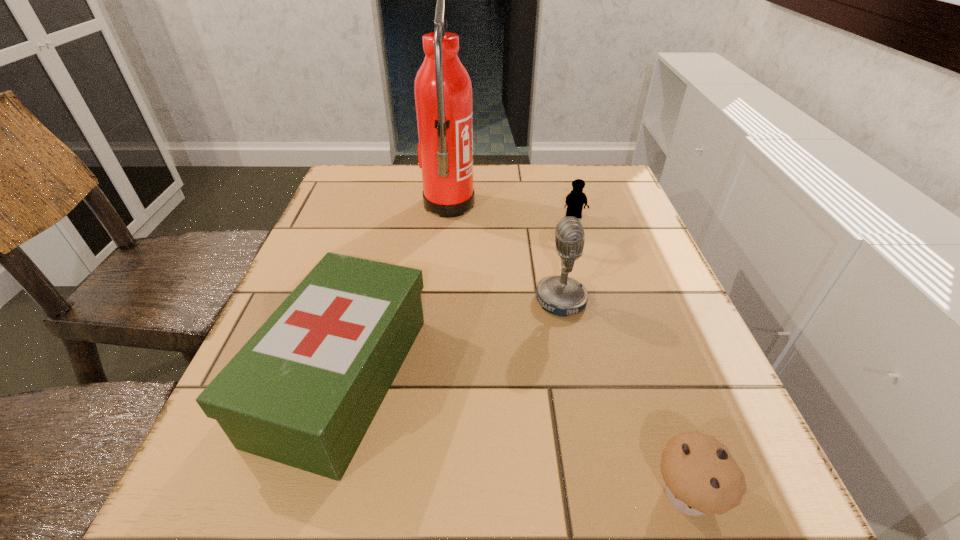
In the image, there is a desktop. Identify the location of vacant space at the far edge. This screenshot has width=960, height=540. (526, 165).

In the image, there is a desktop. Find the location of `free region at the near edge`. free region at the near edge is located at coordinates (552, 522).

Where is `vacant space at the left edge`? The width and height of the screenshot is (960, 540). vacant space at the left edge is located at coordinates (367, 241).

At what (x,y) coordinates should I click in order to perform the action: click on vacant space at the right edge. Please return your answer as a coordinate pair (x, y). Looking at the image, I should click on (637, 448).

Where is `vacant space at the far left corner of the desktop`? The width and height of the screenshot is (960, 540). vacant space at the far left corner of the desktop is located at coordinates (376, 171).

The image size is (960, 540). Identify the location of free space at the far right corner. (596, 168).

This screenshot has height=540, width=960. Identify the location of free space between the muffin and the Lego. (630, 355).

You are a GUI agent. You are given a task and a screenshot of the screen. Output one action in this format:
    pyautogui.click(x=<x>, y=<y>)
    Task: Click on the empty location between the Lego and the first-aid kit
    The image size is (960, 540).
    Given the screenshot: What is the action you would take?
    [458, 298]

The width and height of the screenshot is (960, 540). What are the coordinates of `free point between the third tallest object and the Lego` in the screenshot? It's located at (458, 298).

Identify the location of vacant space that's between the fire extinguisher and the microphone. (505, 253).